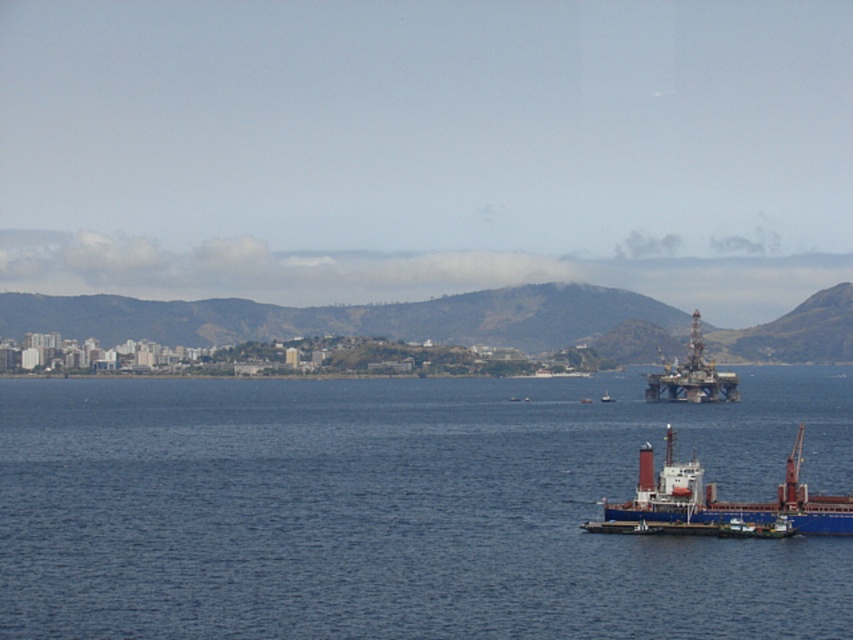
Question: Among these objects, which one is nearest to the camera?

Choices:
 (A) blue water at lower left
 (B) metallic oil rig at upper right
 (C) white plastic boat at center

Answer: (A)

Question: Which of the following is the closest to the observer?

Choices:
 (A) (610, 401)
 (B) (705, 435)

Answer: (B)

Question: Considering the relative positions of blue matte cargo ship at lower right and metallic oil rig at upper right in the image provided, where is blue matte cargo ship at lower right located with respect to metallic oil rig at upper right?

Choices:
 (A) left
 (B) right

Answer: (A)

Question: Does blue matte cargo ship at lower right appear on the right side of metallic oil rig at upper right?

Choices:
 (A) yes
 (B) no

Answer: (B)

Question: Which point is farther to the camera?

Choices:
 (A) blue matte cargo ship at lower right
 (B) metallic oil rig at upper right

Answer: (B)

Question: Can you confirm if blue water at lower left is wider than blue matte cargo ship at lower right?

Choices:
 (A) yes
 (B) no

Answer: (A)